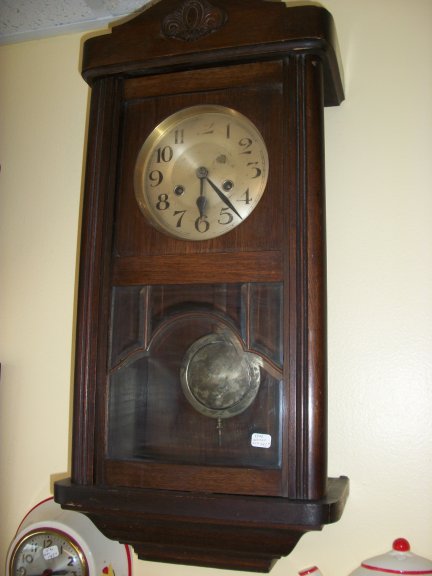
You are a GUI agent. You are given a task and a screenshot of the screen. Output one action in this format:
    pyautogui.click(x=<x>, y=<y>)
    Task: Click on the numbers on cloclk
    The image size is (432, 576).
    Given the screenshot: What is the action you would take?
    pyautogui.click(x=202, y=222)